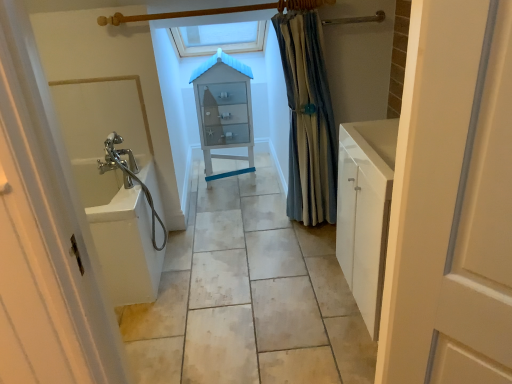
Locate an element on the screen. The width and height of the screenshot is (512, 384). free spot in front of blue striped fabric at right is located at coordinates (311, 248).